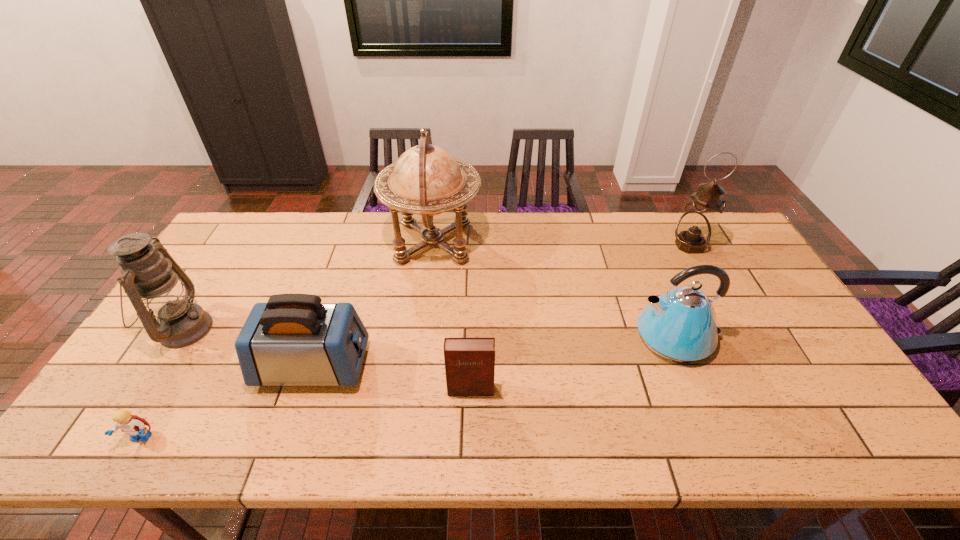
This screenshot has height=540, width=960. Find the location of `free area in between the second shortest object and the right oil lamp`. free area in between the second shortest object and the right oil lamp is located at coordinates (580, 318).

You are a GUI agent. You are given a task and a screenshot of the screen. Output one action in this format:
    pyautogui.click(x=<x>, y=<y>)
    Task: Click on the vacant space that is in between the shortest object and the left oil lamp
    The width and height of the screenshot is (960, 540).
    Given the screenshot: What is the action you would take?
    pyautogui.click(x=162, y=384)

Identify the location of free space that is in between the tallest object and the right oil lamp. (561, 244).

Identify the location of unoccupied area between the farther oil lamp and the toaster. (501, 306).

Identify the location of vacant space that's between the tallest object and the kettle. The width and height of the screenshot is (960, 540). (555, 289).

Identify which object is the closest to the right oil lamp. Please provide its 2D coordinates. Your answer should be formatted as a tuple, i.e. [(x, y)], where the tuple contains the x and y coordinates of a point satisfying the conditions above.

[(680, 325)]

Identify the location of object that can be found as the sixth closest to the toaster. The height and width of the screenshot is (540, 960). (694, 230).

You are a GUI agent. You are given a task and a screenshot of the screen. Output one action in this format:
    pyautogui.click(x=<x>, y=<y>)
    Task: Click on the free space that satisfies the following two spatial constraints: 1. at the spout of the kettle; 2. on the front cover of the diary
    This screenshot has height=540, width=960.
    Given the screenshot: What is the action you would take?
    pyautogui.click(x=698, y=389)

Where is `vacant space that satisfies the following two spatial constraints: 1. at the spout of the kettle; 2. on the front-facing side of the Lego`? The height and width of the screenshot is (540, 960). vacant space that satisfies the following two spatial constraints: 1. at the spout of the kettle; 2. on the front-facing side of the Lego is located at coordinates (719, 438).

Locate an element on the screen. vacant area in the image that satisfies the following two spatial constraints: 1. at the spout of the kettle; 2. on the front cover of the second shortest object is located at coordinates (698, 389).